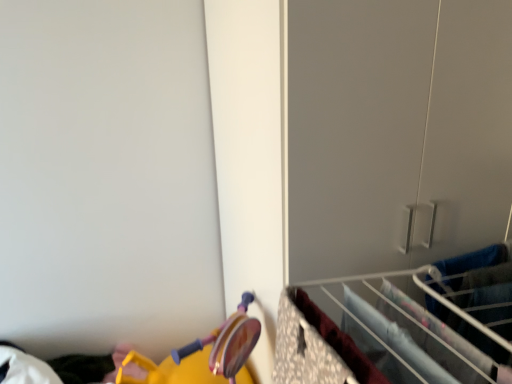
Question: Does metal wire rack at lower right, the first closet when ordered from left to right, have a greater height compared to matte gray closet at center-right, acting as the 2th closet starting from the bottom?

Choices:
 (A) no
 (B) yes

Answer: (A)

Question: Is metal wire rack at lower right, marked as the second closet in a top-to-bottom arrangement, at the left side of matte gray closet at center-right, the first closet in the right-to-left sequence?

Choices:
 (A) yes
 (B) no

Answer: (A)

Question: From a real-world perspective, is metal wire rack at lower right, the first closet when ordered from left to right, on top of matte gray closet at center-right, the first closet in the right-to-left sequence?

Choices:
 (A) yes
 (B) no

Answer: (A)

Question: Does metal wire rack at lower right, the first closet ordered from the bottom, have a greater width compared to matte gray closet at center-right, acting as the 2th closet starting from the bottom?

Choices:
 (A) yes
 (B) no

Answer: (B)

Question: Is metal wire rack at lower right, marked as the second closet in a top-to-bottom arrangement, positioned behind matte gray closet at center-right, acting as the 2th closet starting from the bottom?

Choices:
 (A) yes
 (B) no

Answer: (B)

Question: Is metal wire rack at lower right, the 2th closet from the right, bigger than matte gray closet at center-right, the second closet from the left?

Choices:
 (A) no
 (B) yes

Answer: (A)

Question: Can you confirm if matte gray closet at center-right, the second closet from the left, is taller than metal wire rack at lower right, marked as the second closet in a top-to-bottom arrangement?

Choices:
 (A) no
 (B) yes

Answer: (B)

Question: Are matte gray closet at center-right, acting as the 2th closet starting from the bottom, and metal wire rack at lower right, the 2th closet from the right, located far from each other?

Choices:
 (A) yes
 (B) no

Answer: (B)

Question: Is the position of matte gray closet at center-right, acting as the 2th closet starting from the bottom, less distant than that of metal wire rack at lower right, the 2th closet from the right?

Choices:
 (A) yes
 (B) no

Answer: (B)

Question: Can you confirm if matte gray closet at center-right, the 1th closet when ordered from top to bottom, is positioned to the left of metal wire rack at lower right, marked as the second closet in a top-to-bottom arrangement?

Choices:
 (A) no
 (B) yes

Answer: (A)

Question: Is matte gray closet at center-right, the first closet in the right-to-left sequence, turned away from metal wire rack at lower right, the first closet ordered from the bottom?

Choices:
 (A) no
 (B) yes

Answer: (A)

Question: From the image's perspective, is matte gray closet at center-right, the second closet from the left, under metal wire rack at lower right, marked as the second closet in a top-to-bottom arrangement?

Choices:
 (A) yes
 (B) no

Answer: (B)

Question: Could you tell me if metal wire rack at lower right, marked as the second closet in a top-to-bottom arrangement, is facing floral fabric drawer at lower right?

Choices:
 (A) no
 (B) yes

Answer: (A)